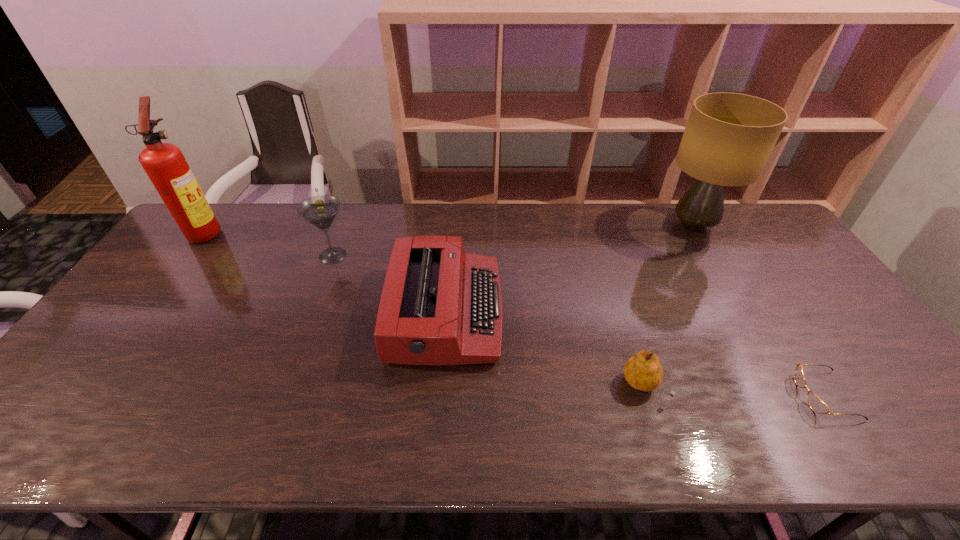
Locate an element on the screen. The width and height of the screenshot is (960, 540). vacant point located between the pear and the lampshade is located at coordinates (668, 306).

Locate an element on the screen. free spot between the fire extinguisher and the lampshade is located at coordinates (449, 229).

The image size is (960, 540). What are the coordinates of `vacant point located between the spectacles and the typewriter` in the screenshot? It's located at (636, 354).

Where is `vacant point located between the typewriter and the shortest object`? The width and height of the screenshot is (960, 540). vacant point located between the typewriter and the shortest object is located at coordinates (636, 354).

Locate an element on the screen. This screenshot has height=540, width=960. free space between the shortest object and the fire extinguisher is located at coordinates (516, 314).

This screenshot has height=540, width=960. In order to click on free space between the typewriter and the fire extinguisher in this screenshot , I will do `click(325, 272)`.

Locate an element on the screen. This screenshot has height=540, width=960. unoccupied position between the lampshade and the pear is located at coordinates (668, 306).

Point out which object is positioned as the fourth nearest to the third object from left to right. Please provide its 2D coordinates. Your answer should be formatted as a tuple, i.e. [(x, y)], where the tuple contains the x and y coordinates of a point satisfying the conditions above.

[(164, 163)]

Select which object appears as the fourth closest to the spectacles. Please provide its 2D coordinates. Your answer should be formatted as a tuple, i.e. [(x, y)], where the tuple contains the x and y coordinates of a point satisfying the conditions above.

[(321, 210)]

Where is `free space that satisfies the following two spatial constraints: 1. on the front-facing side of the leftmost object; 2. on the right side of the martini`? free space that satisfies the following two spatial constraints: 1. on the front-facing side of the leftmost object; 2. on the right side of the martini is located at coordinates (188, 255).